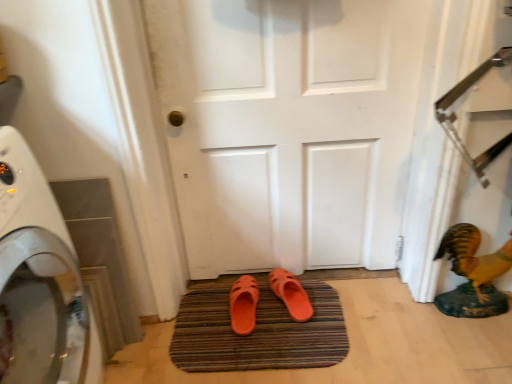
Where is `free space on the front side of orange rubber slipper at center, the first footwear from the right`? Image resolution: width=512 pixels, height=384 pixels. free space on the front side of orange rubber slipper at center, the first footwear from the right is located at coordinates (294, 345).